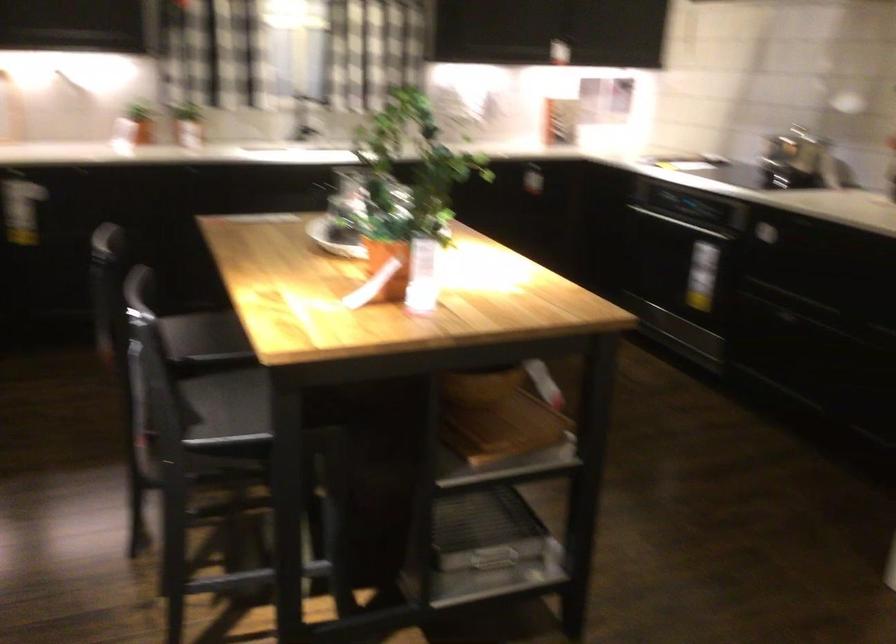
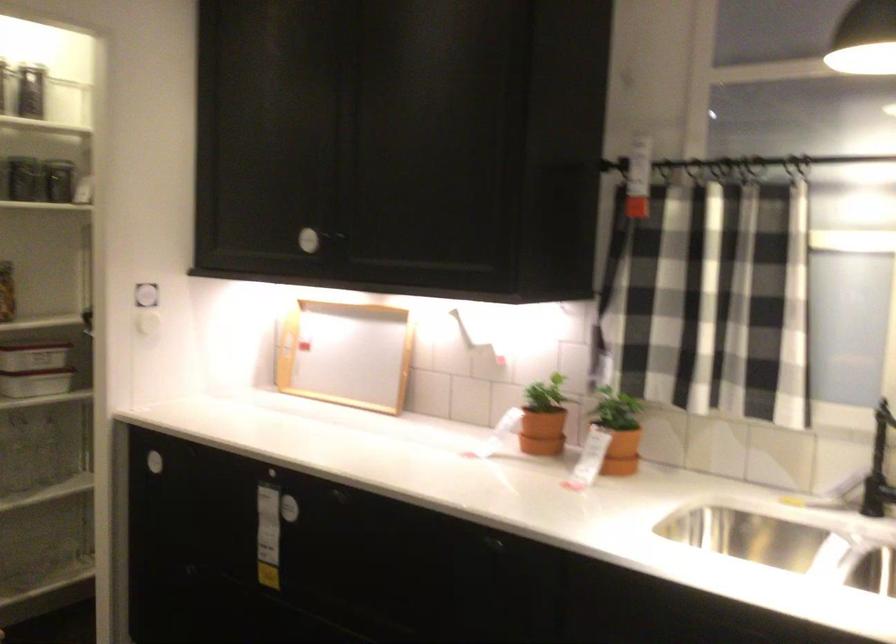
Find the pixel in the second image that matches the point at 194,118 in the first image.

(617, 430)